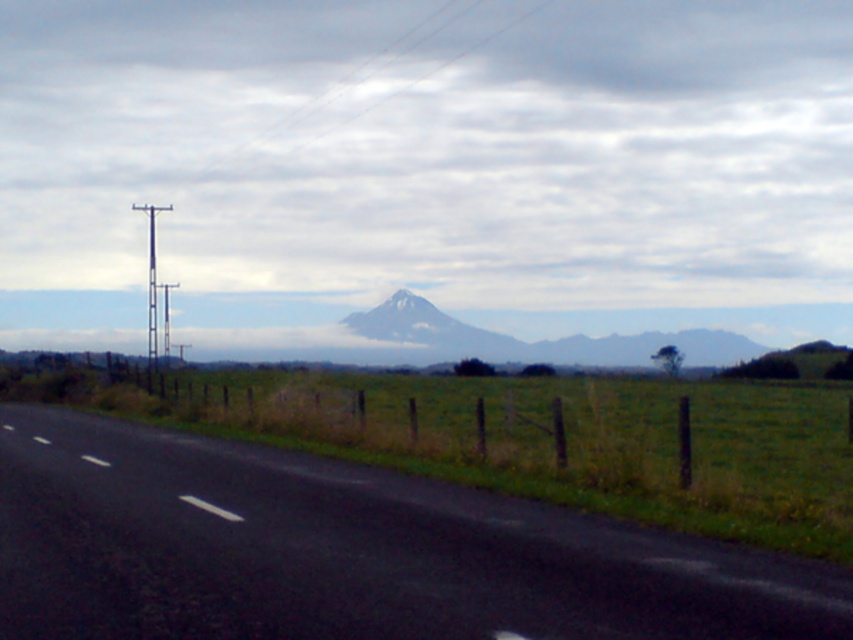
Who is more forward, (843,220) or (358,545)?

Point (358,545) is in front.

Is cloudy sky at upper center bigger than black asphalt road at center?

Indeed, cloudy sky at upper center has a larger size compared to black asphalt road at center.

Which is in front, point (758, 257) or point (228, 534)?

Point (228, 534) is in front.

You are a GUI agent. You are given a task and a screenshot of the screen. Output one action in this format:
    pyautogui.click(x=<x>, y=<y>)
    Task: Click on the cloudy sky at upper center
    
    Given the screenshot: What is the action you would take?
    pyautogui.click(x=434, y=147)